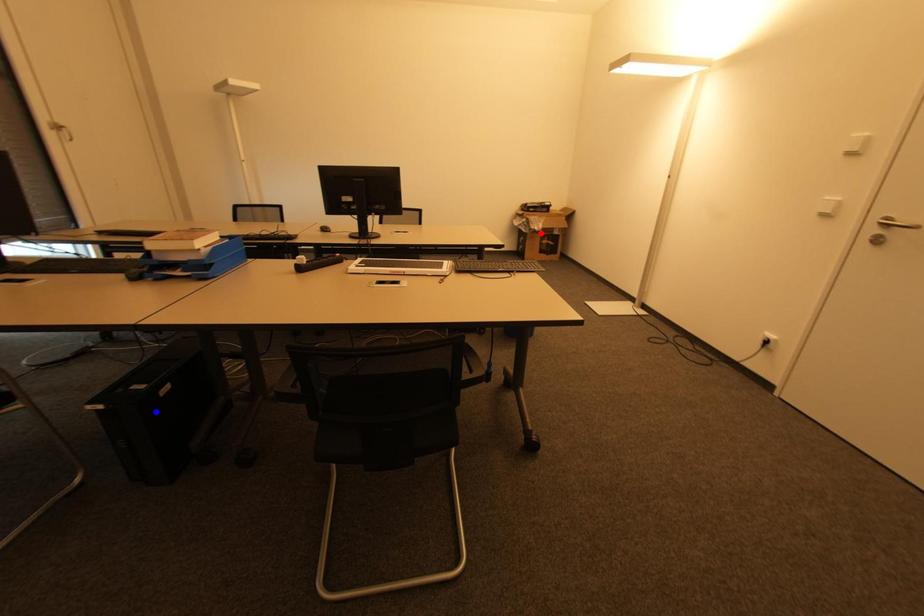
Question: In the image, two points are highlighted. Which point is nearer to the camera? Reply with the corresponding letter.

Choices:
 (A) blue point
 (B) red point

Answer: (A)